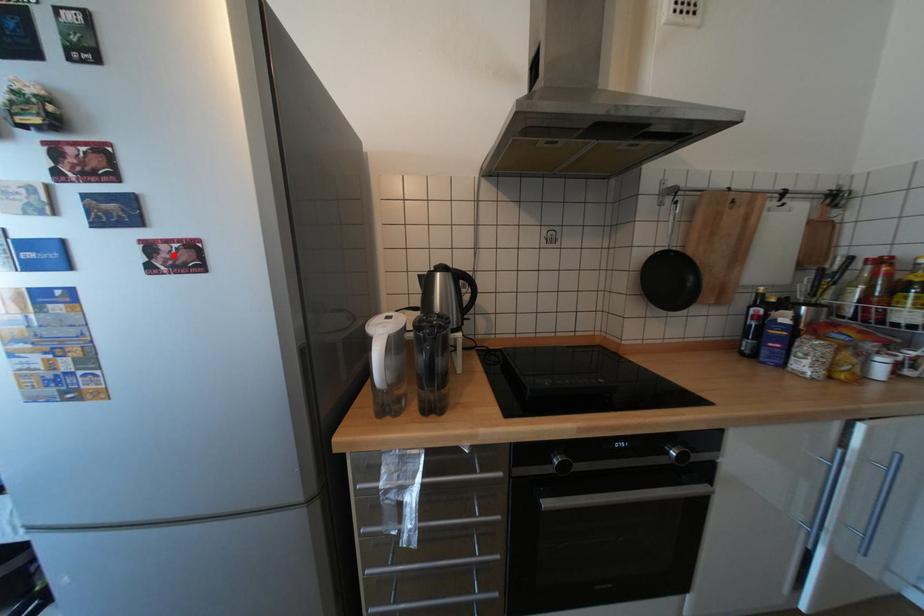
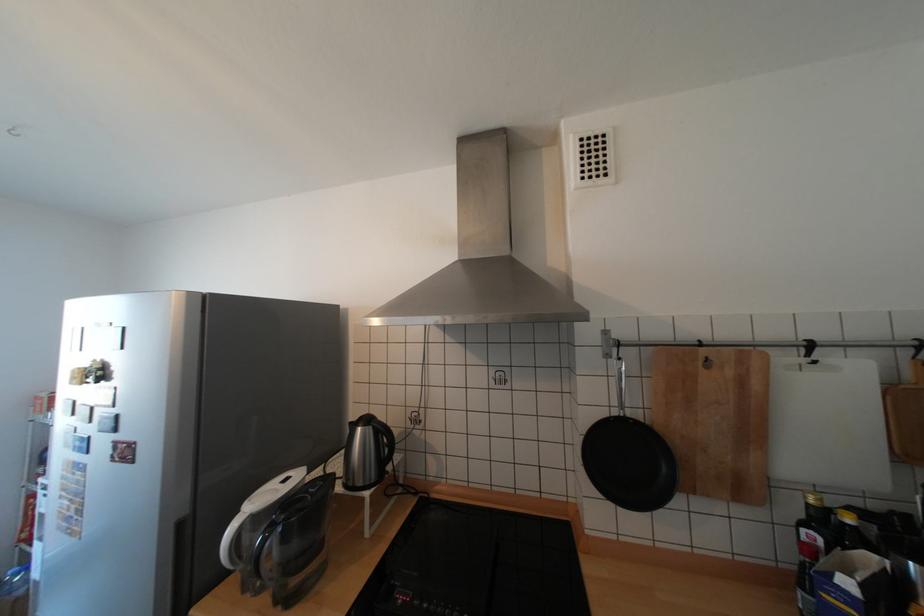
Locate, in the second image, the point that corresponds to the highlighted location in the first image.

(128, 451)